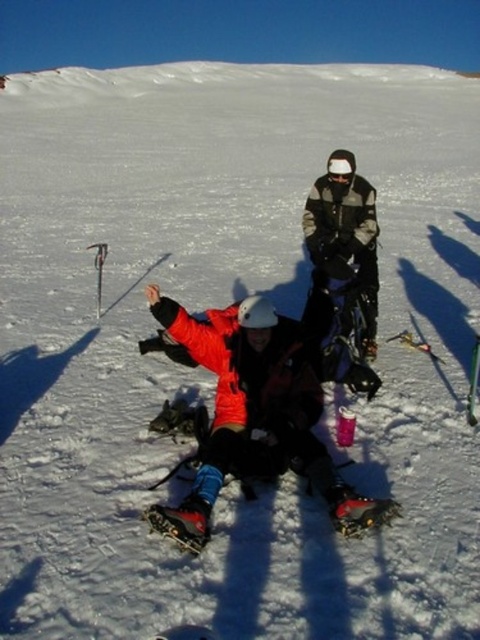
You are planning to cross a frozen lake and need to choose between the red plastic snowshoe at lower left and the red rubber snowshoe at lower center. Based on their positions in the image, which one is closer to the edge of the lake?

The red plastic snowshoe at lower left is closer to the edge of the lake because it is positioned below the red rubber snowshoe at lower center, indicating it is nearer to the lower edge of the scene which likely corresponds to the lake edge.